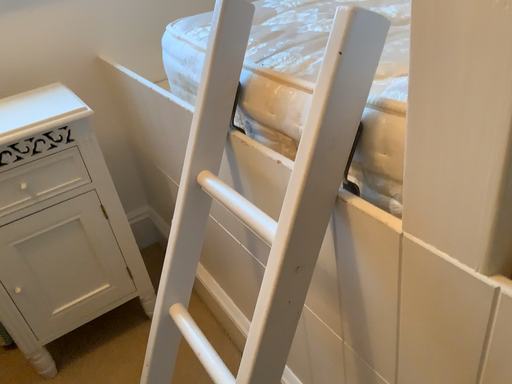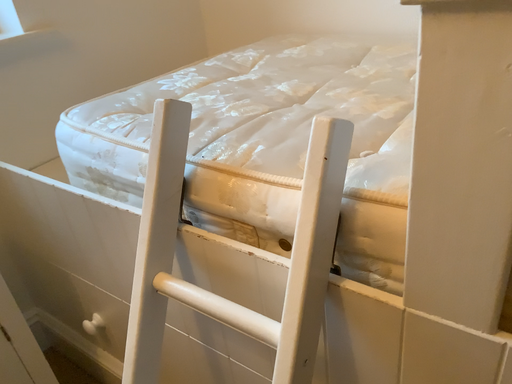
Question: How did the camera likely rotate when shooting the video?

Choices:
 (A) rotated downward
 (B) rotated upward

Answer: (B)